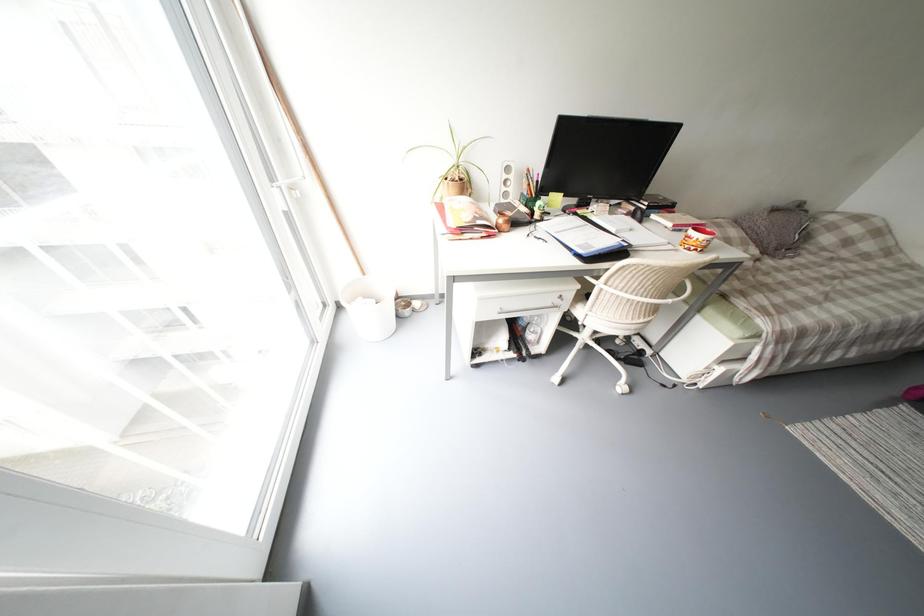
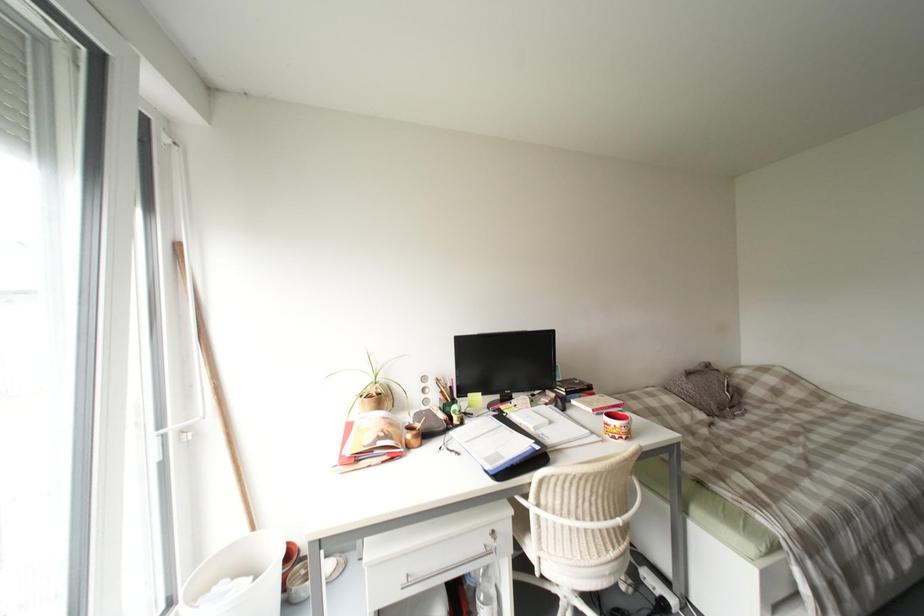
Question: The first image is from the beginning of the video and the second image is from the end. How did the camera likely rotate when shooting the video?

Choices:
 (A) Left
 (B) Right
 (C) Up
 (D) Down

Answer: (C)